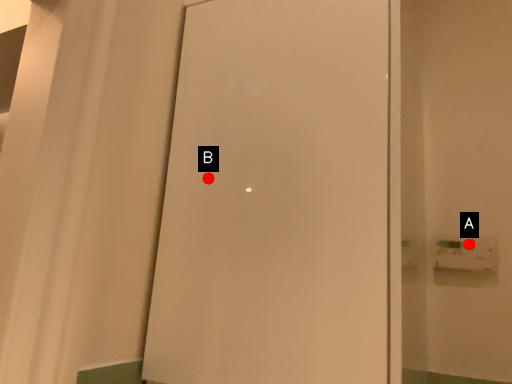
Question: Two points are circled on the image, labeled by A and B beside each circle. Which point is further to the camera?

Choices:
 (A) A is further
 (B) B is further

Answer: (A)